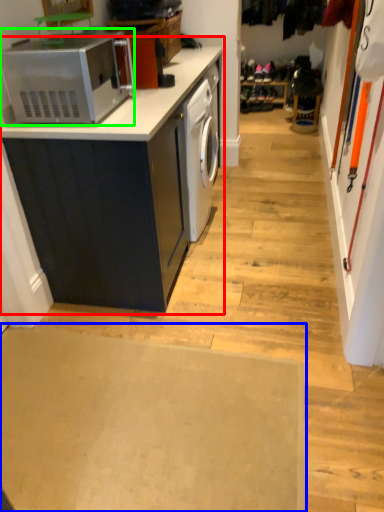
Question: Estimate the real-world distances between objects in this image. Which object is farther from cabinetry (highlighted by a red box), plain (highlighted by a blue box) or home appliance (highlighted by a green box)?

Choices:
 (A) plain
 (B) home appliance

Answer: (A)